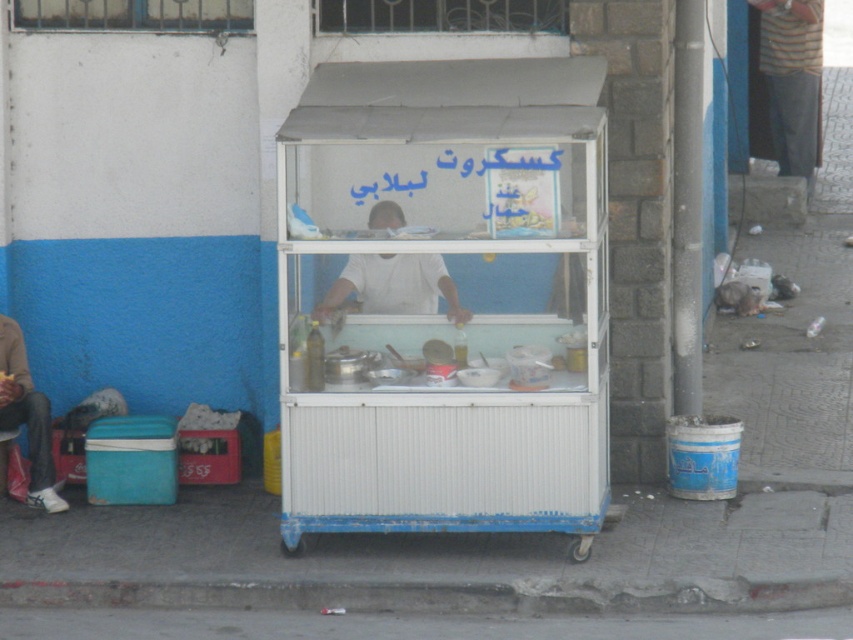
Is white metal cart at center to the left of matte black jacket at left from the viewer's perspective?

In fact, white metal cart at center is to the right of matte black jacket at left.

Which is above, white metal cart at center or matte black jacket at left?

white metal cart at center

Find the location of a particular element. The width and height of the screenshot is (853, 640). white metal cart at center is located at coordinates (445, 300).

Identify the location of white metal cart at center. (445, 300).

Is white matte street vendor at center behind matte black jacket at left?

That is False.

Does white matte street vendor at center appear on the right side of matte black jacket at left?

Yes, white matte street vendor at center is to the right of matte black jacket at left.

Which is in front, point (392, 225) or point (12, 358)?

Point (392, 225) is more forward.

The image size is (853, 640). I want to click on white matte street vendor at center, so click(392, 285).

Is white metal cart at center to the right of white matte street vendor at center from the viewer's perspective?

Correct, you'll find white metal cart at center to the right of white matte street vendor at center.

Does white metal cart at center have a greater width compared to white matte street vendor at center?

Correct, the width of white metal cart at center exceeds that of white matte street vendor at center.

Which is in front, point (527, 93) or point (332, 291)?

Positioned in front is point (332, 291).

Where is `white metal cart at center`? white metal cart at center is located at coordinates pyautogui.click(x=445, y=300).